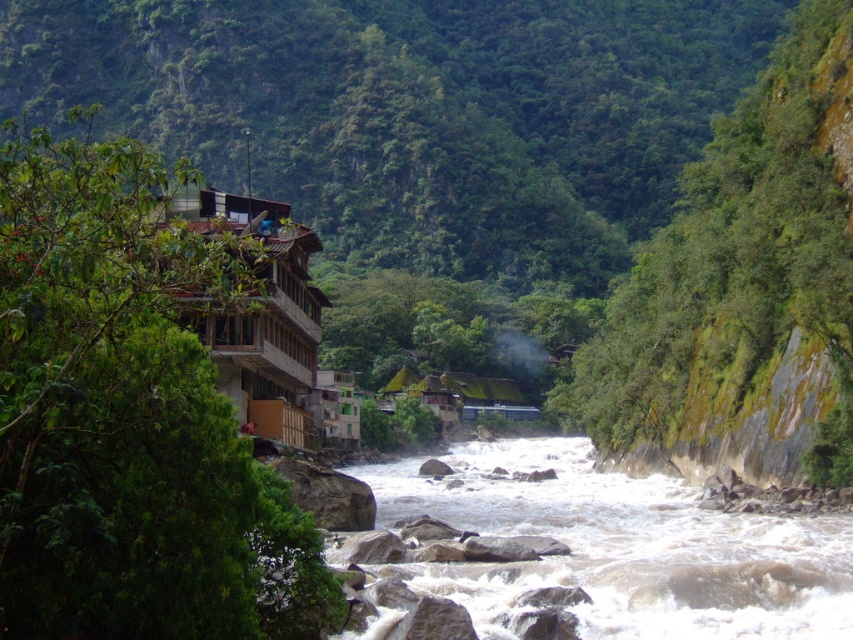
You are a photographer planning to capture the white frothy water at center and the wooden balcony at left in a single frame. Based on their sizes, which object will appear smaller in the photo?

The white frothy water at center appears smaller in the photo because its width is less than the wooden balcony at left.